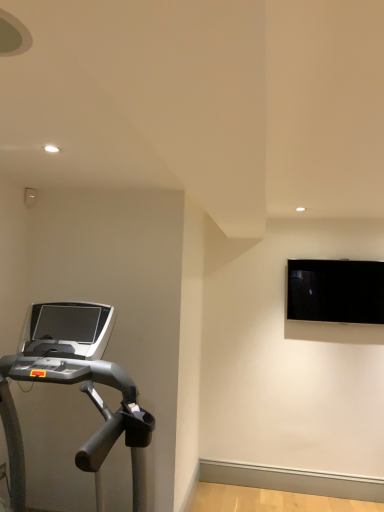
Measure the distance between black glossy monitor at upper right and camera.

black glossy monitor at upper right and camera are 3.47 meters apart.

What do you see at coordinates (335, 291) in the screenshot? I see `black glossy monitor at upper right` at bounding box center [335, 291].

At what (x,y) coordinates should I click in order to perform the action: click on black glossy monitor at upper right. Please return your answer as a coordinate pair (x, y). The width and height of the screenshot is (384, 512). Looking at the image, I should click on (335, 291).

Locate an element on the screen. Image resolution: width=384 pixels, height=512 pixels. silver metallic treadmill at left is located at coordinates (80, 389).

Describe the element at coordinates (80, 389) in the screenshot. I see `silver metallic treadmill at left` at that location.

Measure the distance between silver metallic treadmill at left and camera.

silver metallic treadmill at left and camera are 1.68 meters apart.

Image resolution: width=384 pixels, height=512 pixels. In order to click on black glossy monitor at upper right in this screenshot , I will do `click(335, 291)`.

Which object is positioned more to the left, silver metallic treadmill at left or black glossy monitor at upper right?

silver metallic treadmill at left is more to the left.

Relative to black glossy monitor at upper right, is silver metallic treadmill at left in front or behind?

Visually, silver metallic treadmill at left is located in front of black glossy monitor at upper right.

Does point (88, 350) lie behind point (354, 284)?

No.

From the image's perspective, is silver metallic treadmill at left on black glossy monitor at upper right?

No, from the image's perspective, silver metallic treadmill at left is not on top of black glossy monitor at upper right.

From a real-world perspective, is silver metallic treadmill at left physically above black glossy monitor at upper right?

No, from a real-world perspective, silver metallic treadmill at left is not over black glossy monitor at upper right

Between silver metallic treadmill at left and black glossy monitor at upper right, which one has larger width?

With larger width is silver metallic treadmill at left.

Does silver metallic treadmill at left have a lesser height compared to black glossy monitor at upper right?

No, silver metallic treadmill at left is not shorter than black glossy monitor at upper right.

Does silver metallic treadmill at left have a smaller size compared to black glossy monitor at upper right?

Actually, silver metallic treadmill at left might be larger than black glossy monitor at upper right.

Does silver metallic treadmill at left contain black glossy monitor at upper right?

No, silver metallic treadmill at left does not contain black glossy monitor at upper right.

Is silver metallic treadmill at left next to black glossy monitor at upper right and touching it?

No, silver metallic treadmill at left is not next to black glossy monitor at upper right.

Is silver metallic treadmill at left looking in the opposite direction of black glossy monitor at upper right?

No.

What's the angular difference between silver metallic treadmill at left and black glossy monitor at upper right's facing directions?

There is a 90.9-degree angle between the facing directions of silver metallic treadmill at left and black glossy monitor at upper right.

How much distance is there between silver metallic treadmill at left and black glossy monitor at upper right?

The distance of silver metallic treadmill at left from black glossy monitor at upper right is 1.89 meters.

Image resolution: width=384 pixels, height=512 pixels. What are the coordinates of `treadmill on the left of the black glossy monitor at upper right` in the screenshot? It's located at (80, 389).

Does black glossy monitor at upper right appear on the right side of silver metallic treadmill at left?

Yes, black glossy monitor at upper right is to the right of silver metallic treadmill at left.

Which is in front, black glossy monitor at upper right or silver metallic treadmill at left?

silver metallic treadmill at left is closer to the camera.

Which point is more distant from viewer, (x=353, y=301) or (x=147, y=416)?

Positioned behind is point (x=353, y=301).

From the image's perspective, relative to silver metallic treadmill at left, is black glossy monitor at upper right above or below?

From the image's perspective, black glossy monitor at upper right appears above silver metallic treadmill at left.

From a real-world perspective, who is located higher, black glossy monitor at upper right or silver metallic treadmill at left?

black glossy monitor at upper right, from a real-world perspective.

Is black glossy monitor at upper right wider or thinner than silver metallic treadmill at left?

In the image, black glossy monitor at upper right appears to be more narrow than silver metallic treadmill at left.

Considering the relative sizes of black glossy monitor at upper right and silver metallic treadmill at left in the image provided, is black glossy monitor at upper right taller than silver metallic treadmill at left?

Incorrect, the height of black glossy monitor at upper right is not larger of that of silver metallic treadmill at left.

Between black glossy monitor at upper right and silver metallic treadmill at left, which one has smaller size?

Smaller between the two is black glossy monitor at upper right.

Is black glossy monitor at upper right inside the boundaries of silver metallic treadmill at left, or outside?

black glossy monitor at upper right is located beyond the bounds of silver metallic treadmill at left.

Is there a large distance between black glossy monitor at upper right and silver metallic treadmill at left?

Yes, black glossy monitor at upper right is far from silver metallic treadmill at left.

Is silver metallic treadmill at left at the back of black glossy monitor at upper right?

No, silver metallic treadmill at left is not at the back of black glossy monitor at upper right.

How different are the orientations of black glossy monitor at upper right and silver metallic treadmill at left in degrees?

The facing directions of black glossy monitor at upper right and silver metallic treadmill at left are 90.9 degrees apart.

You are a GUI agent. You are given a task and a screenshot of the screen. Output one action in this format:
    pyautogui.click(x=<x>, y=<y>)
    Task: Click on the computer monitor above the silver metallic treadmill at left (from a real-world perspective)
    This screenshot has width=384, height=512.
    Given the screenshot: What is the action you would take?
    pyautogui.click(x=335, y=291)

I want to click on computer monitor located above the silver metallic treadmill at left (from a real-world perspective), so click(x=335, y=291).

Where is `treadmill in front of the black glossy monitor at upper right`? This screenshot has width=384, height=512. treadmill in front of the black glossy monitor at upper right is located at coordinates (80, 389).